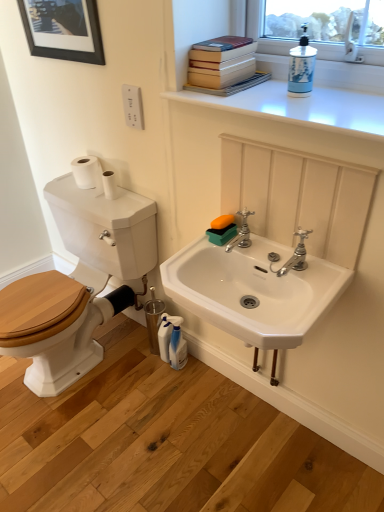
The image size is (384, 512). What do you see at coordinates (110, 185) in the screenshot?
I see `white matte toilet paper at upper left` at bounding box center [110, 185].

The width and height of the screenshot is (384, 512). What do you see at coordinates (105, 232) in the screenshot?
I see `woodenmaterial/texturetoilet at left` at bounding box center [105, 232].

Measure the distance between black matte picture frame at upper left and camera.

black matte picture frame at upper left is 4.71 feet from camera.

Based on the photo, in order to face white ceramic sink at center, should I rotate leftwards or rightwards?

You should look right and rotate roughly 7.085 degrees.

The image size is (384, 512). What are the coordinates of `white ceramic sink at center` in the screenshot? It's located at click(x=253, y=290).

At what (x,y) coordinates should I click in order to perform the action: click on silver metallic faucet at center, which is counted as the first tap, starting from the left. Please return your answer as a coordinate pair (x, y). Image resolution: width=384 pixels, height=512 pixels. Looking at the image, I should click on (241, 232).

Is black matte picture frame at upper left beside white glossy counter top at upper center?

black matte picture frame at upper left and white glossy counter top at upper center are clearly separated.

Where is `counter top to the right of black matte picture frame at upper left`? The width and height of the screenshot is (384, 512). counter top to the right of black matte picture frame at upper left is located at coordinates (301, 108).

Could you tell me if black matte picture frame at upper left is facing white glossy counter top at upper center?

No, black matte picture frame at upper left is not facing towards white glossy counter top at upper center.

Which point is more distant from viewer, (x=281, y=269) or (x=306, y=33)?

The point (x=306, y=33) is behind.

Is white glossy soap dispenser at upper right, the 2th cleaning product when ordered from bottom to top, a part of polished chrome faucet at center, which ranks as the 2th tap in left-to-right order?

No, white glossy soap dispenser at upper right, the 2th cleaning product when ordered from bottom to top, is not surrounded by polished chrome faucet at center, which ranks as the 2th tap in left-to-right order.

Is polished chrome faucet at center, which ranks as the 2th tap in left-to-right order, in front of or behind white glossy soap dispenser at upper right, the 2th cleaning product when ordered from bottom to top, in the image?

Clearly, polished chrome faucet at center, which ranks as the 2th tap in left-to-right order, is behind white glossy soap dispenser at upper right, the 2th cleaning product when ordered from bottom to top.

Is polished chrome faucet at center, which ranks as the 2th tap in left-to-right order, to the right of white glossy soap dispenser at upper right, placed as the 1th cleaning product when sorted from top to bottom, from the viewer's perspective?

In fact, polished chrome faucet at center, which ranks as the 2th tap in left-to-right order, is to the left of white glossy soap dispenser at upper right, placed as the 1th cleaning product when sorted from top to bottom.

Which point is more forward, (303, 77) or (229, 250)?

The point (303, 77) is more forward.

From the image's perspective, is white glossy soap dispenser at upper right, the 2th cleaning product when ordered from bottom to top, above or below silver metallic faucet at center, marked as the second tap in a right-to-left arrangement?

white glossy soap dispenser at upper right, the 2th cleaning product when ordered from bottom to top, is situated higher than silver metallic faucet at center, marked as the second tap in a right-to-left arrangement, in the image.

Is white glossy counter top at upper center oriented away from polished chrome faucet at center, which ranks as the 2th tap in left-to-right order?

No, white glossy counter top at upper center is not facing the opposite direction of polished chrome faucet at center, which ranks as the 2th tap in left-to-right order.

Find the location of a particular element. Image resolution: width=384 pixels, height=512 pixels. counter top located above the polished chrome faucet at center, which is counted as the first tap, starting from the right (from the image's perspective) is located at coordinates (301, 108).

Is white glossy counter top at upper center to the right of polished chrome faucet at center, which ranks as the 2th tap in left-to-right order, from the viewer's perspective?

Yes, white glossy counter top at upper center is to the right of polished chrome faucet at center, which ranks as the 2th tap in left-to-right order.

Based on the photo, from a real-world perspective, between white matte toilet paper at upper left and white plastic spray bottle at lower center, positioned as the second cleaning product in front-to-back order, who is vertically lower?

white plastic spray bottle at lower center, positioned as the second cleaning product in front-to-back order, from a real-world perspective.

Does white matte toilet paper at upper left touch white plastic spray bottle at lower center, the 2th cleaning product from the top?

No.

Can you confirm if white matte toilet paper at upper left is thinner than white plastic spray bottle at lower center, the 2th cleaning product when ordered from right to left?

A: Yes, white matte toilet paper at upper left is thinner than white plastic spray bottle at lower center, the 2th cleaning product when ordered from right to left.

Is hardcover books at upper right bigger than black matte picture frame at upper left?

Indeed, hardcover books at upper right has a larger size compared to black matte picture frame at upper left.

Can you confirm if hardcover books at upper right is taller than black matte picture frame at upper left?

Incorrect, the height of hardcover books at upper right is not larger of that of black matte picture frame at upper left.

In the image, there is a black matte picture frame at upper left. At what (x,y) coordinates should I click in order to perform the action: click on book below it (from the image's perspective). Please return your answer as a coordinate pair (x, y). The image size is (384, 512). Looking at the image, I should click on (224, 66).

Is black matte picture frame at upper left facing towards woodenmaterial/texturetoilet at left?

No, black matte picture frame at upper left does not turn towards woodenmaterial/texturetoilet at left.

Is point (47, 45) positioned behind point (72, 237)?

No, it is not.

Which object is thinner, black matte picture frame at upper left or woodenmaterial/texturetoilet at left?

With smaller width is black matte picture frame at upper left.

Considering the sizes of objects black matte picture frame at upper left and woodenmaterial/texturetoilet at left in the image provided, who is smaller, black matte picture frame at upper left or woodenmaterial/texturetoilet at left?

Smaller between the two is black matte picture frame at upper left.

Find the location of a particular element. The width and height of the screenshot is (384, 512). counter top beneath the black matte picture frame at upper left (from a real-world perspective) is located at coordinates (301, 108).

The height and width of the screenshot is (512, 384). In order to click on cleaning product above the polished chrome faucet at center, which ranks as the 2th tap in left-to-right order (from a real-world perspective) in this screenshot , I will do `click(301, 67)`.

From the image, which object appears to be farther from silver metallic faucet at center, which is counted as the first tap, starting from the left, black matte picture frame at upper left or hardcover books at upper right?

Result: Based on the image, black matte picture frame at upper left appears to be further to silver metallic faucet at center, which is counted as the first tap, starting from the left.

From the image, which object appears to be nearer to white matte toilet paper at upper left, woodenmaterial/texturetoilet at left or silver metallic faucet at center, marked as the second tap in a right-to-left arrangement?

woodenmaterial/texturetoilet at left.

When comparing their distances from white glossy soap dispenser at upper right, the 2th cleaning product when ordered from bottom to top, does white ceramic sink at center or hardcover books at upper right seem further?

white ceramic sink at center is positioned further to the anchor white glossy soap dispenser at upper right, the 2th cleaning product when ordered from bottom to top.

Based on their spatial positions, is black matte picture frame at upper left or woodenmaterial/texturetoilet at left further from hardcover books at upper right?

woodenmaterial/texturetoilet at left.

When comparing their distances from white matte toilet paper at upper left, does polished chrome faucet at center, which is counted as the first tap, starting from the right, or woodenmaterial/texturetoilet at left seem closer?

woodenmaterial/texturetoilet at left is positioned closer to the anchor white matte toilet paper at upper left.

Which object lies further to the anchor point white plastic spray bottle at lower center, the first cleaning product positioned from the back, polished chrome faucet at center, which is counted as the first tap, starting from the right, or white glossy soap dispenser at upper right, marked as the 1th cleaning product in a front-to-back arrangement?

white glossy soap dispenser at upper right, marked as the 1th cleaning product in a front-to-back arrangement.

Estimate the real-world distances between objects in this image. Which object is further from woodenmaterial/texturetoilet at left, silver metallic faucet at center, which is counted as the first tap, starting from the left, or white plastic spray bottle at lower center, the 2th cleaning product from the top?

silver metallic faucet at center, which is counted as the first tap, starting from the left, is further to woodenmaterial/texturetoilet at left.

Estimate the real-world distances between objects in this image. Which object is closer to white glossy counter top at upper center, white ceramic sink at center or black matte picture frame at upper left?

white ceramic sink at center is positioned closer to the anchor white glossy counter top at upper center.

This screenshot has height=512, width=384. In order to click on tap between polished chrome faucet at center, which is counted as the first tap, starting from the right, and white plastic spray bottle at lower center, the 2th cleaning product when ordered from right to left, in the front-back direction in this screenshot , I will do `click(241, 232)`.

Where is `counter top between white glossy soap dispenser at upper right, marked as the 1th cleaning product in a front-to-back arrangement, and white ceramic sink at center from top to bottom`? This screenshot has width=384, height=512. counter top between white glossy soap dispenser at upper right, marked as the 1th cleaning product in a front-to-back arrangement, and white ceramic sink at center from top to bottom is located at coordinates (301, 108).

I want to click on book between black matte picture frame at upper left and polished chrome faucet at center, which is counted as the first tap, starting from the right, in the vertical direction, so click(x=224, y=66).

Locate an element on the screen. toilet paper between white glossy counter top at upper center and white plastic spray bottle at lower center, the first cleaning product positioned from the back, vertically is located at coordinates (110, 185).